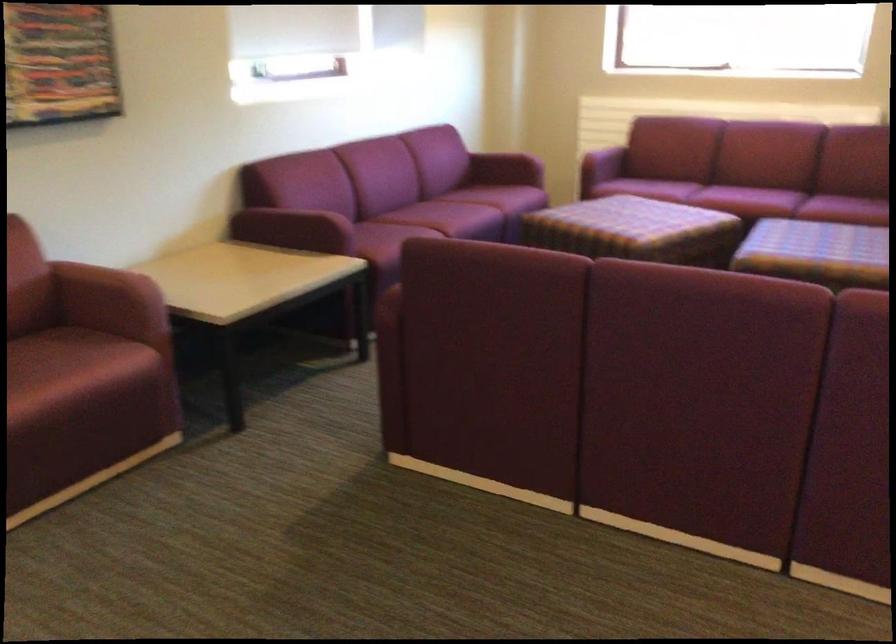
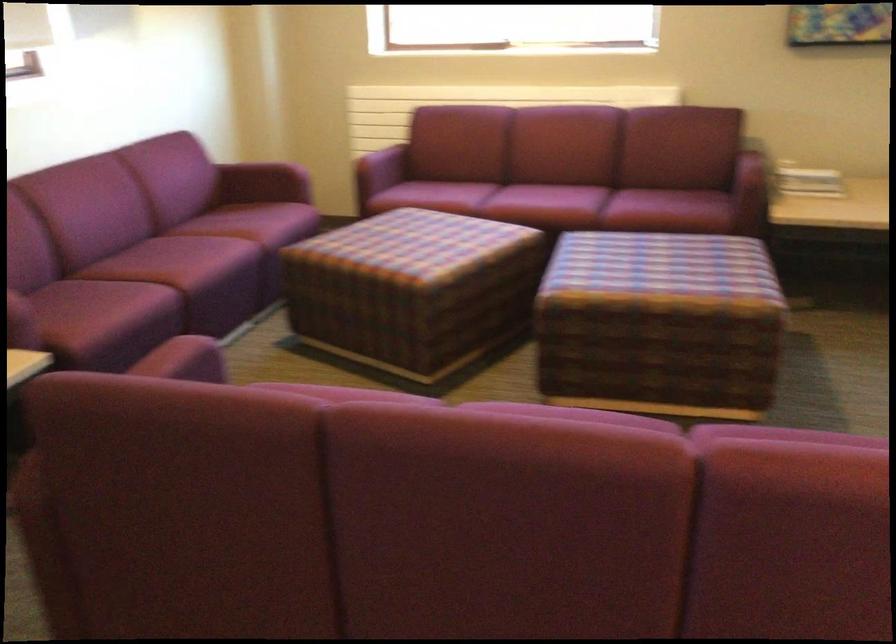
Find the pixel in the second image that matches (x=497, y=194) in the first image.

(254, 222)